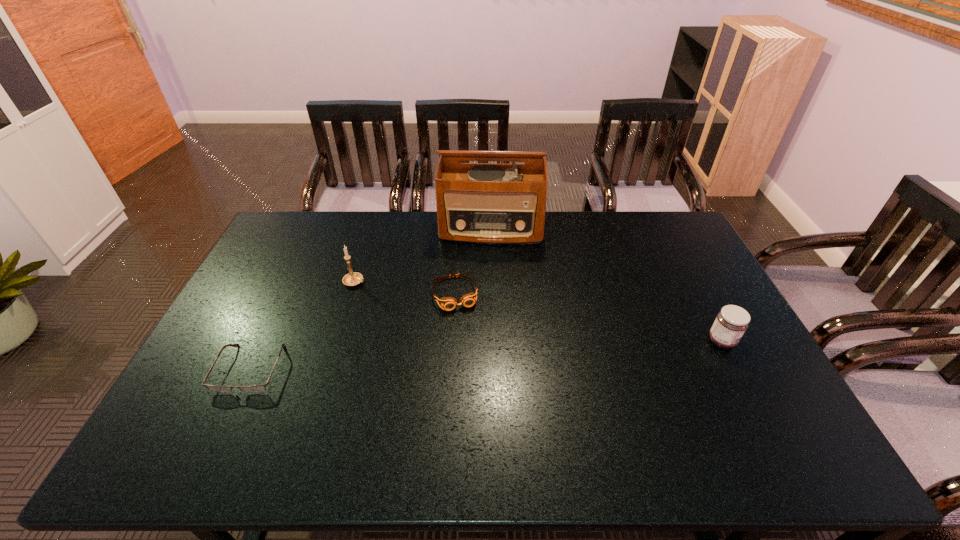
Locate an element on the screen. Image resolution: width=960 pixels, height=540 pixels. object that is at the left edge is located at coordinates (252, 388).

Identify the location of object that is positioned at the right edge. (732, 321).

At what (x,y) coordinates should I click in order to perform the action: click on object that is at the near left corner. Please return your answer as a coordinate pair (x, y). This screenshot has width=960, height=540. Looking at the image, I should click on (252, 388).

In the image, there is a desktop. At what (x,y) coordinates should I click in order to perform the action: click on vacant space at the far edge. Please return your answer as a coordinate pair (x, y). The height and width of the screenshot is (540, 960). Looking at the image, I should click on (634, 234).

Image resolution: width=960 pixels, height=540 pixels. In the image, there is a desktop. Identify the location of free space at the near edge. (256, 394).

You are a GUI agent. You are given a task and a screenshot of the screen. Output one action in this format:
    pyautogui.click(x=<x>, y=<y>)
    Task: Click on the free location at the left edge of the desktop
    The width and height of the screenshot is (960, 540).
    Given the screenshot: What is the action you would take?
    tap(265, 316)

Identify the location of vacant area at the right edge. (677, 307).

Where is `free point at the far left corner`? This screenshot has height=540, width=960. free point at the far left corner is located at coordinates (267, 246).

At what (x,y) coordinates should I click in order to perform the action: click on empty location between the jam and the candle holder. Please return your answer as a coordinate pair (x, y). Image resolution: width=960 pixels, height=540 pixels. Looking at the image, I should click on (539, 311).

Image resolution: width=960 pixels, height=540 pixels. Identify the location of vacant space that is in between the candle holder and the goggles. pos(405,288).